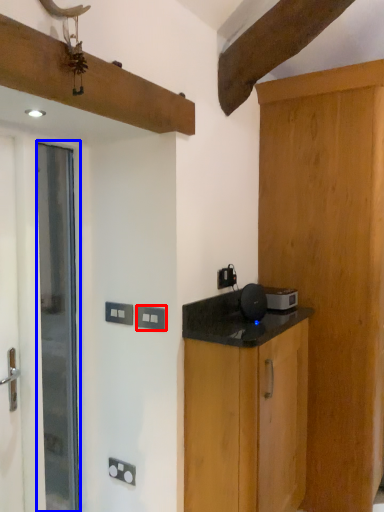
Question: Which object is closer to the camera taking this photo, electric outlet (highlighted by a red box) or door (highlighted by a blue box)?

Choices:
 (A) electric outlet
 (B) door

Answer: (B)